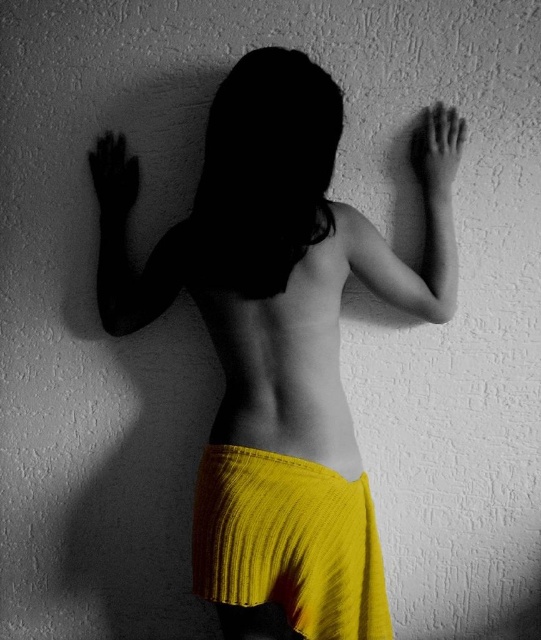
Does smooth skin hand at upper right have a lesser height compared to black matte hand at left?

Yes.

Based on the photo, which is above, smooth skin hand at upper right or black matte hand at left?

smooth skin hand at upper right is above.

Where is `smooth skin hand at upper right`? The image size is (541, 640). smooth skin hand at upper right is located at coordinates (437, 145).

Is black matte arm at upper left to the left of smooth skin hand at upper right from the viewer's perspective?

Yes, black matte arm at upper left is to the left of smooth skin hand at upper right.

What do you see at coordinates (127, 248) in the screenshot? I see `black matte arm at upper left` at bounding box center [127, 248].

Which is in front, point (102, 237) or point (451, 177)?

Point (451, 177) is in front.

This screenshot has width=541, height=640. Find the location of `black matte arm at upper left`. black matte arm at upper left is located at coordinates pos(127,248).

From the picture: Is yellow knitted skirt at center below smooth skin hand at upper right?

Indeed, yellow knitted skirt at center is positioned under smooth skin hand at upper right.

The width and height of the screenshot is (541, 640). Find the location of `yellow knitted skirt at center`. yellow knitted skirt at center is located at coordinates click(x=288, y=541).